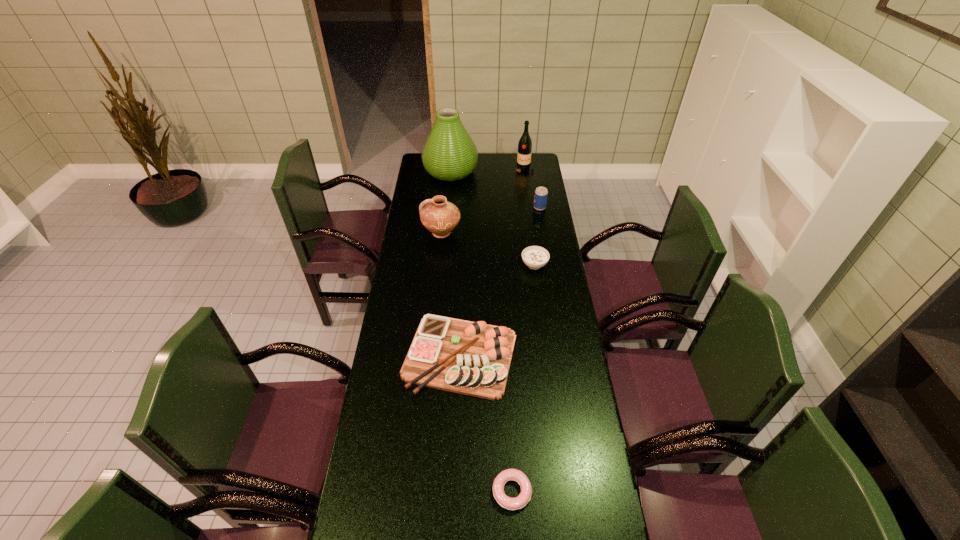
You are a GUI agent. You are given a task and a screenshot of the screen. Output one action in this format:
    pyautogui.click(x=<x>, y=<y>)
    Task: Click on the vase present at the left edge
    Image resolution: width=960 pixels, height=540 pixels.
    Given the screenshot: What is the action you would take?
    pyautogui.click(x=449, y=154)

Find the location of `pottery present at the left edge`. pottery present at the left edge is located at coordinates (439, 216).

Find the location of a particular element. This screenshot has height=540, width=960. platter that is positioned at the left edge is located at coordinates (472, 358).

What are the coordinates of `wine bottle at the right edge` in the screenshot? It's located at (525, 143).

Locate an element on the screen. beer can that is at the right edge is located at coordinates (540, 199).

This screenshot has height=540, width=960. I want to click on soup bowl at the right edge, so click(535, 257).

Find the location of a particular element. This screenshot has width=960, height=540. object that is positioned at the far left corner is located at coordinates (449, 154).

The image size is (960, 540). I want to click on object that is at the far right corner, so tap(525, 143).

Identify the location of vacant space at the far edge of the desktop. (497, 154).

Where is `free space at the left edge of the desktop`? free space at the left edge of the desktop is located at coordinates (419, 213).